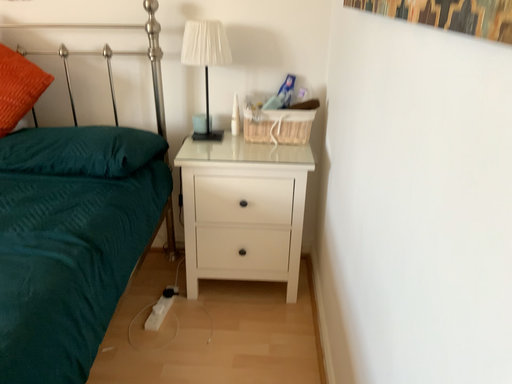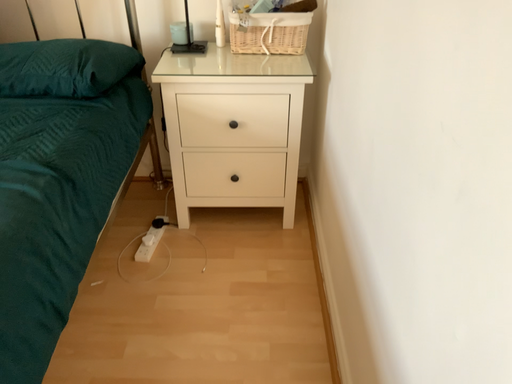
Question: Which way did the camera rotate in the video?

Choices:
 (A) rotated upward
 (B) rotated downward

Answer: (B)